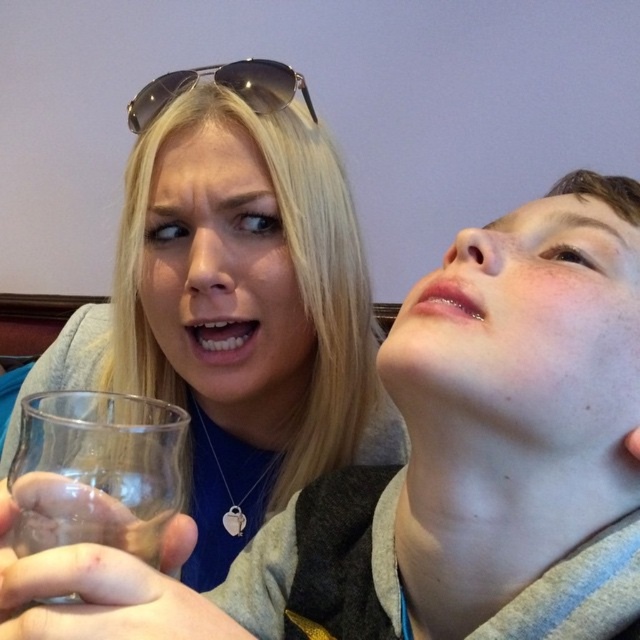
You are a delivery person who needs to place a 7.5 inch long package between the clear glass at left and the metallic aviator sunglasses at upper center. Can the package fit in the space between them?

The clear glass at left and the metallic aviator sunglasses at upper center are 7.49 inches apart from each other. Since the package is 7.5 inches long, it cannot fit in the space between them as the distance is slightly less than required.

What object is located at the coordinates point (237, 305) in the image?

The point (237, 305) corresponds to the clear glass at left.